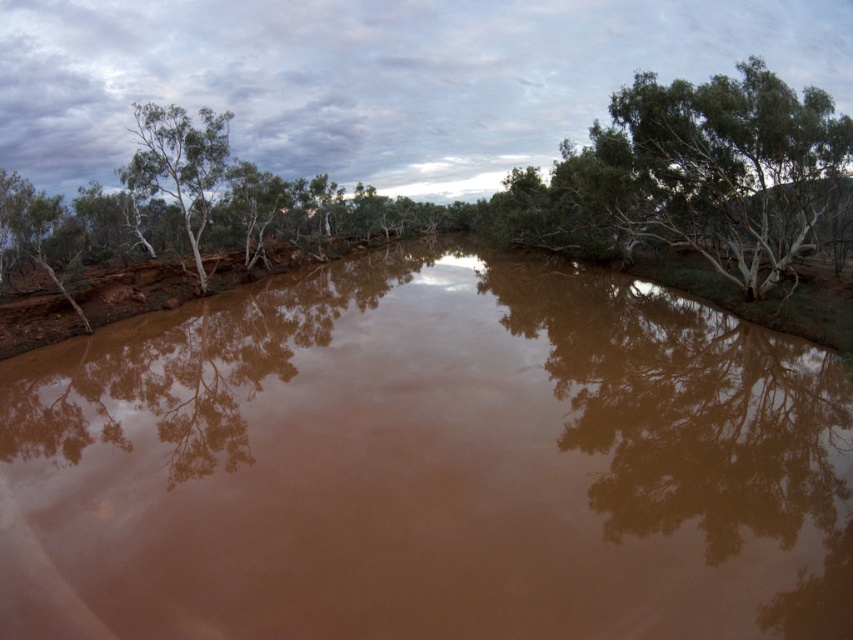
Which of these two, brown matte water at center or green leafy tree at left, stands shorter?

Standing shorter between the two is brown matte water at center.

The image size is (853, 640). Describe the element at coordinates (428, 465) in the screenshot. I see `brown matte water at center` at that location.

Is point (397, 332) in front of point (144, 180)?

Yes, point (397, 332) is closer to viewer.

Locate an element on the screen. The width and height of the screenshot is (853, 640). brown matte water at center is located at coordinates (428, 465).